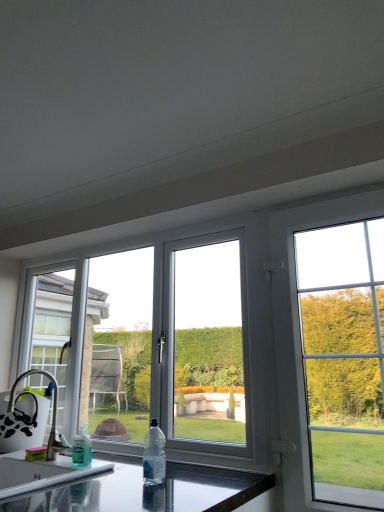
At what (x,y) coordinates should I click in order to perform the action: click on unoccupied area in front of silver metallic faucet at lower left. Please return your answer as a coordinate pair (x, y). This screenshot has height=512, width=384. Looking at the image, I should click on (14, 474).